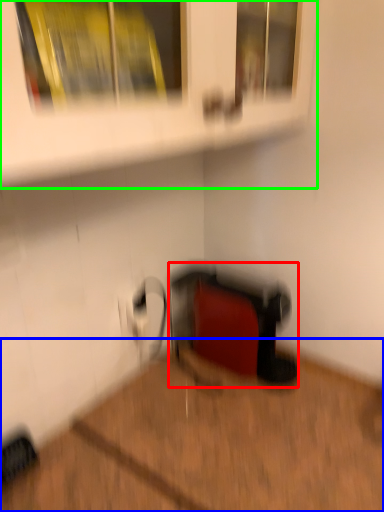
Question: Which object is the farthest from wide (highlighted by a red box)? Choose among these: hardwood (highlighted by a blue box) or shelf (highlighted by a green box).

Choices:
 (A) hardwood
 (B) shelf

Answer: (B)